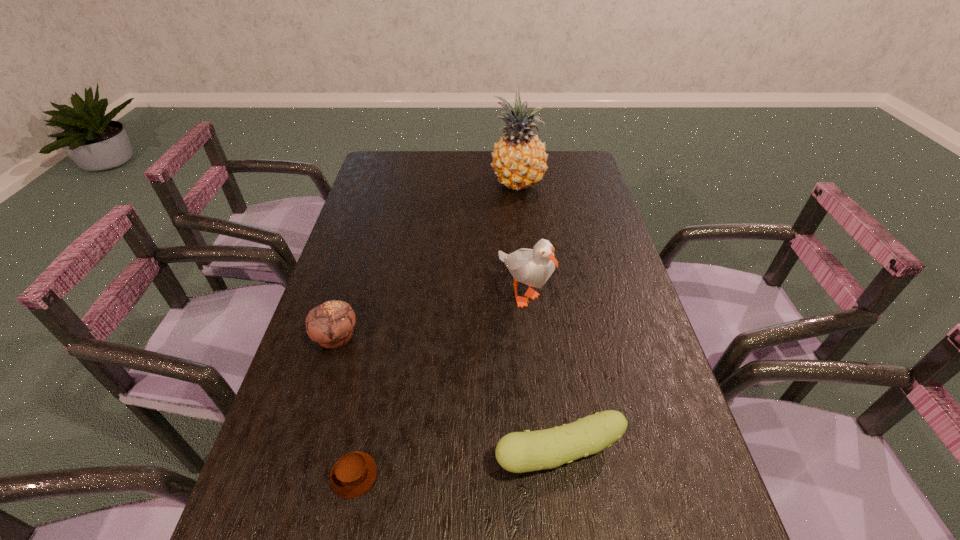
Select which object appears as the third closest to the pineapple. Please provide its 2D coordinates. Your answer should be formatted as a tuple, i.e. [(x, y)], where the tuple contains the x and y coordinates of a point satisfying the conditions above.

[(518, 452)]

At what (x,y) coordinates should I click in order to perform the action: click on free location that satisfies the following two spatial constraints: 1. at the beak of the cucumber; 2. on the left side of the gull. Please return your answer as a coordinate pair (x, y). The width and height of the screenshot is (960, 540). Looking at the image, I should click on (540, 455).